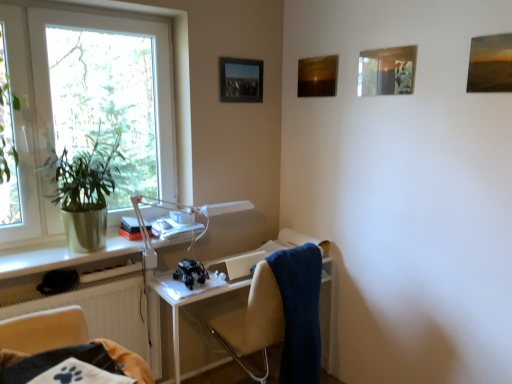
Question: From a real-world perspective, relative to beige fabric chair at lower left, the first chair viewed from the left, is blue soft towel at right vertically above or below?

Choices:
 (A) below
 (B) above

Answer: (A)

Question: In the image, is blue soft towel at right on the left side or the right side of beige fabric chair at lower left, the first chair viewed from the left?

Choices:
 (A) right
 (B) left

Answer: (A)

Question: Considering the real-world distances, which object is closest to the matte wooden picture frame at upper right, which is the 4th picture frame from back to front?

Choices:
 (A) beige fabric chair at center, the 1th chair in the right-to-left sequence
 (B) black plastic toy at center, which is counted as the 1th equipment, starting from the bottom
 (C) white plastic window at left
 (D) blue soft towel at right
 (E) metallic silver picture frame at upper center, marked as the 1th picture frame in a back-to-front arrangement

Answer: (D)

Question: Which object is the closest to the matte wooden picture frame at upper right, the 1th picture frame in the right-to-left sequence?

Choices:
 (A) white plastic desk lamp at upper left, which is the 1th equipment in top-to-bottom order
 (B) matte wooden picture frame at upper center, the third picture frame positioned from the front
 (C) metallic silver picture frame at upper center, placed as the fourth picture frame when sorted from front to back
 (D) black plastic toy at center, which is counted as the 1th equipment, starting from the bottom
 (E) blue soft towel at right

Answer: (B)